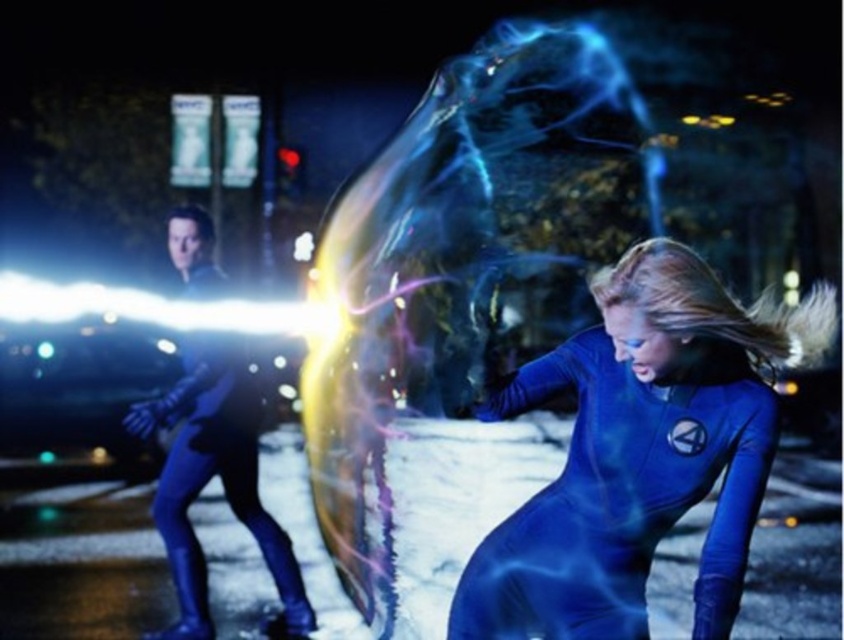
Who is positioned more to the left, blue spandex suit at lower right or matte blue suit at left?

matte blue suit at left is more to the left.

Is blue spandex suit at lower right closer to the viewer compared to matte blue suit at left?

Yes, it is.

The height and width of the screenshot is (640, 844). What do you see at coordinates (641, 451) in the screenshot? I see `blue spandex suit at lower right` at bounding box center [641, 451].

Locate an element on the screen. This screenshot has width=844, height=640. blue spandex suit at lower right is located at coordinates (641, 451).